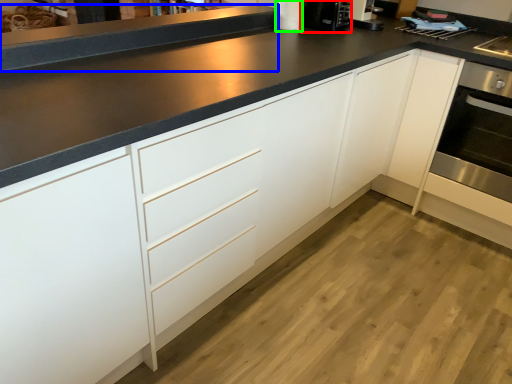
Question: Which object is the farthest from coffee machine (highlighted by a red box)? Choose among these: counter top (highlighted by a blue box) or appliance (highlighted by a green box).

Choices:
 (A) counter top
 (B) appliance

Answer: (A)